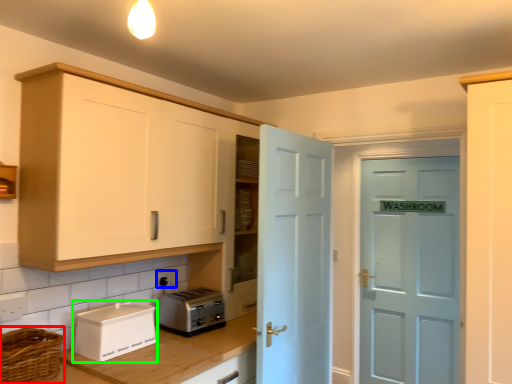
Question: Which object is the farthest from basket (highlighted by a red box)? Choose among these: electric outlet (highlighted by a blue box) or appliance (highlighted by a green box).

Choices:
 (A) electric outlet
 (B) appliance

Answer: (A)